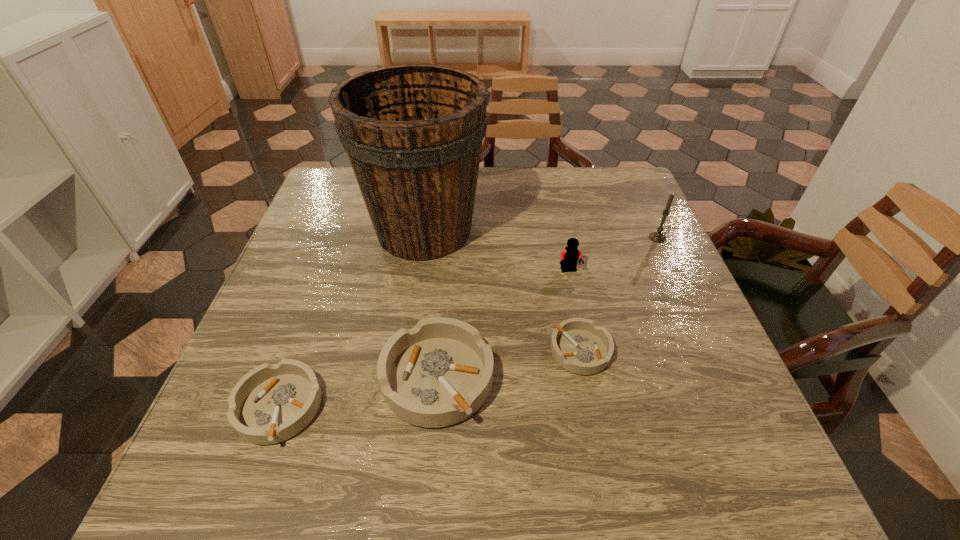
Find the location of a particular element. free space between the shortest object and the fourth tallest object is located at coordinates (509, 364).

At what (x,y) coordinates should I click in order to perform the action: click on free space between the tallest ashtray and the tallest object. Please return your answer as a coordinate pair (x, y). Looking at the image, I should click on (431, 304).

At what (x,y) coordinates should I click in order to perform the action: click on empty location between the shortest object and the third tallest object. Please return your answer as a coordinate pair (x, y). Image resolution: width=960 pixels, height=540 pixels. Looking at the image, I should click on click(575, 310).

You are a GUI agent. You are given a task and a screenshot of the screen. Output one action in this format:
    pyautogui.click(x=<x>, y=<y>)
    Task: Click on the vacant space in between the second ashtray from left to right and the second tallest ashtray
    
    Given the screenshot: What is the action you would take?
    pyautogui.click(x=358, y=393)

Where is `free space between the Lego and the rightmost ashtray`? free space between the Lego and the rightmost ashtray is located at coordinates (575, 310).

Identify the location of free spot between the rightmost ashtray and the rightmost object. (619, 294).

I want to click on the fourth closest object to the shortest ashtray, so click(x=658, y=237).

I want to click on object that stands as the fifth closest to the bucket, so click(658, 237).

Select which ashtray appears as the closest to the third shortest object. Please provide its 2D coordinates. Your answer should be formatted as a tuple, i.e. [(x, y)], where the tuple contains the x and y coordinates of a point satisfying the conditions above.

[(271, 403)]

Point out which ashtray is positioned as the second nearest to the tallest object. Please provide its 2D coordinates. Your answer should be formatted as a tuple, i.e. [(x, y)], where the tuple contains the x and y coordinates of a point satisfying the conditions above.

[(578, 345)]